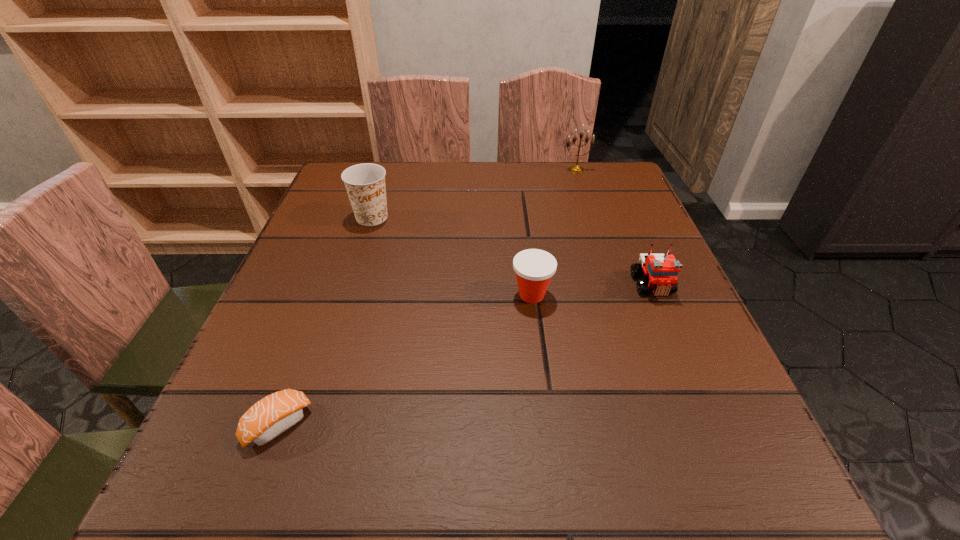
At what (x,y) coordinates should I click in order to perform the action: click on vacant space situated 0.220m on the back of the farther Dixie cup. Please return your answer as a coordinate pair (x, y). The height and width of the screenshot is (540, 960). Looking at the image, I should click on (390, 163).

This screenshot has height=540, width=960. Identify the location of free space located 0.150m on the front-facing side of the rightmost object. (687, 367).

Locate an element on the screen. vacant point located 0.290m on the back of the right Dixie cup is located at coordinates (520, 201).

This screenshot has width=960, height=540. I want to click on vacant space situated 0.130m on the right of the nearest object, so click(x=398, y=425).

What are the coordinates of `candelabrum at the far edge` in the screenshot? It's located at (575, 168).

You are a GUI agent. You are given a task and a screenshot of the screen. Output one action in this format:
    pyautogui.click(x=<x>, y=<y>)
    Task: Click on the Dixie cup that is at the far edge
    
    Given the screenshot: What is the action you would take?
    pyautogui.click(x=365, y=183)

Locate an element on the screen. This screenshot has height=540, width=960. object located in the near edge section of the desktop is located at coordinates (271, 416).

Where is `Dixie cup that is at the left edge`? The width and height of the screenshot is (960, 540). Dixie cup that is at the left edge is located at coordinates coord(365,183).

Image resolution: width=960 pixels, height=540 pixels. I want to click on sushi present at the left edge, so [x=271, y=416].

Locate an element on the screen. Image resolution: width=960 pixels, height=540 pixels. candelabrum present at the right edge is located at coordinates (575, 168).